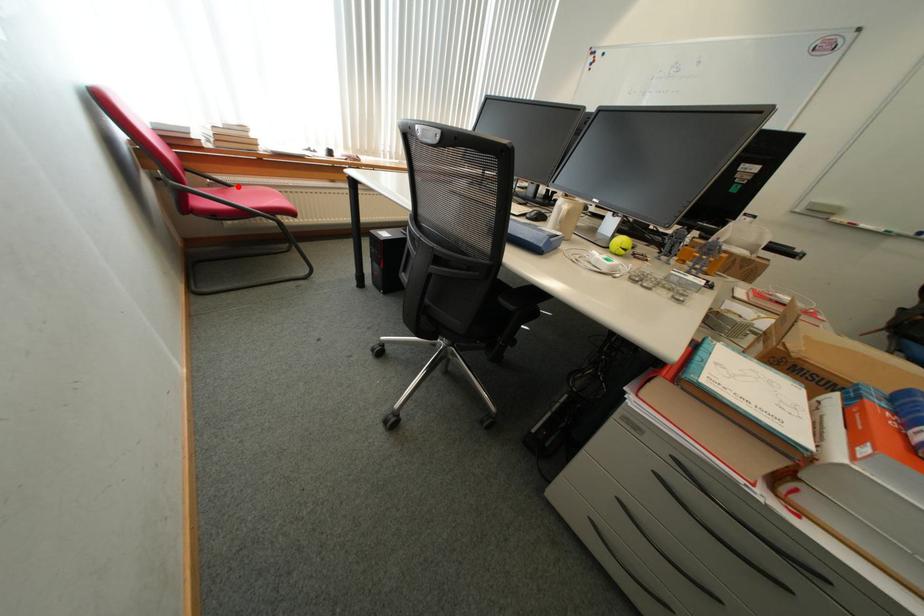
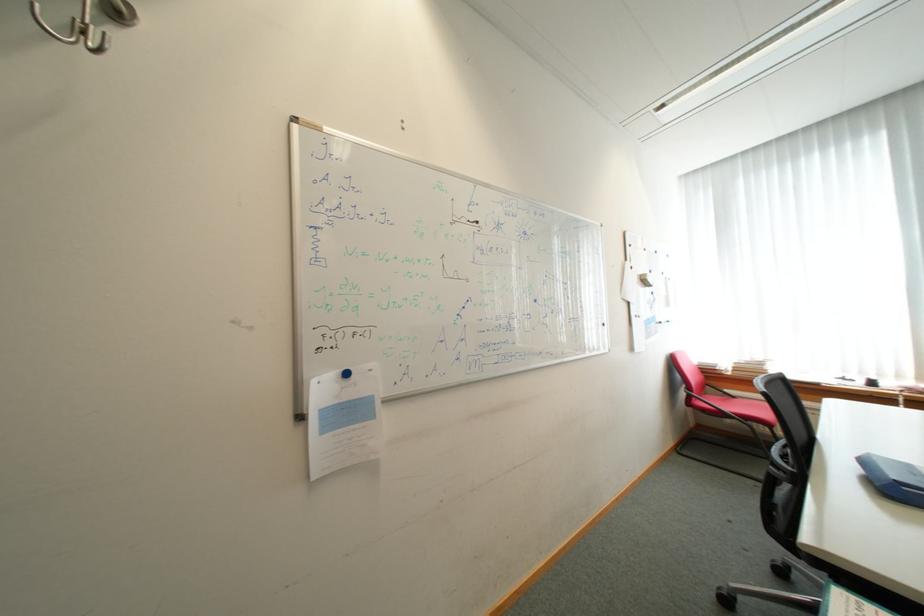
Find the pixel in the second image that matches the highlighted location in the first image.

(743, 398)